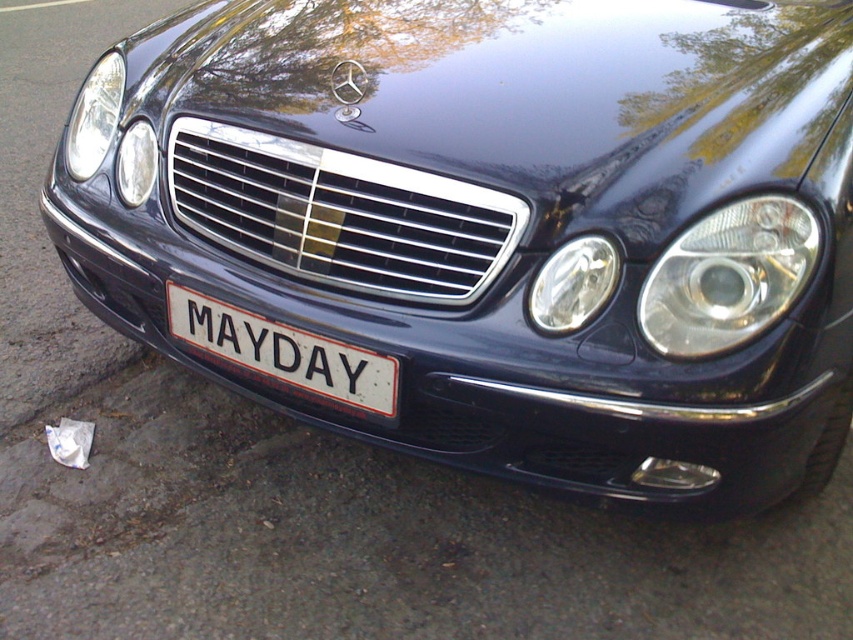
Question: In this image, where is clear plastic headlight at right located relative to white matte license plate at center?

Choices:
 (A) below
 (B) above

Answer: (B)

Question: Considering the real-world distances, which object is closest to the white matte license plate at center?

Choices:
 (A) clear plastic headlight at right
 (B) matte black headlight at left
 (C) clear plastic headlight at center-left
 (D) matte silver headlight at left

Answer: (C)

Question: Based on their relative distances, which object is nearer to the clear plastic headlight at center-left?

Choices:
 (A) matte black headlight at left
 (B) matte silver headlight at left
 (C) clear plastic headlight at right

Answer: (C)

Question: Can you confirm if clear plastic headlight at right is thinner than clear plastic headlight at center-left?

Choices:
 (A) no
 (B) yes

Answer: (A)

Question: Which of the following is the closest to the observer?

Choices:
 (A) matte black headlight at left
 (B) matte silver headlight at left
 (C) clear plastic headlight at right
 (D) white matte license plate at center

Answer: (C)

Question: Does white matte license plate at center have a lesser width compared to matte black headlight at left?

Choices:
 (A) yes
 (B) no

Answer: (A)